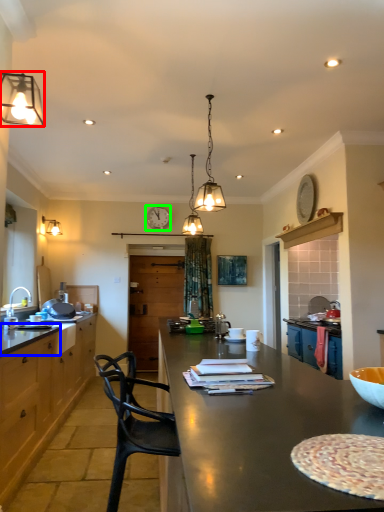
Question: Which is farther away from lamp (highlighted by a red box)? counter top (highlighted by a blue box) or clock (highlighted by a green box)?

Choices:
 (A) counter top
 (B) clock

Answer: (B)